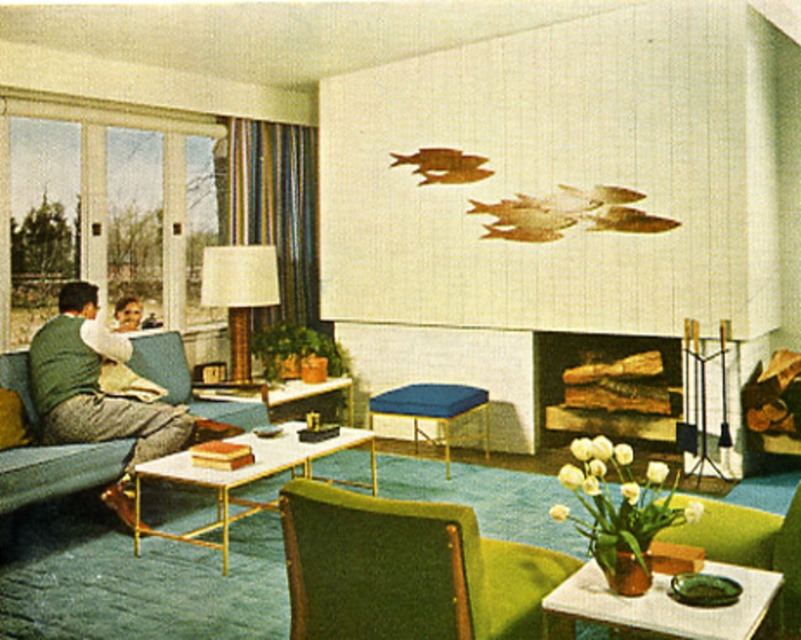
You are planning to place a large potted plant in the living room. You have two options for placement locations near the green fabric armchair at lower center and the blue fabric ottoman at center. Which location has more space around it to accommodate the plant?

The green fabric armchair at lower center is bigger than the blue fabric ottoman at center, so there is more space around the blue fabric ottoman at center to place the large potted plant.

You are sitting on the green fabric armchair at lower center and want to grab a wooden log from the wooden logs at center. Can you reach them without moving from the chair?

The green fabric armchair at lower center is in front of wooden logs at center, so you can reach them without moving from the chair.

You are arranging flowers in the living room and need to place a vase between the green fabric side table at lower right and the matte brown lampshade at center. Which object should the vase be closer to if you want it to be centered between them?

The vase should be closer to the matte brown lampshade at center because the green fabric side table at lower right is positioned on the right side of the matte brown lampshade at center, meaning the lampshade is to the left of the side table. To center the vase between them, it should lean towards the lampshade since the side table is further to the right.